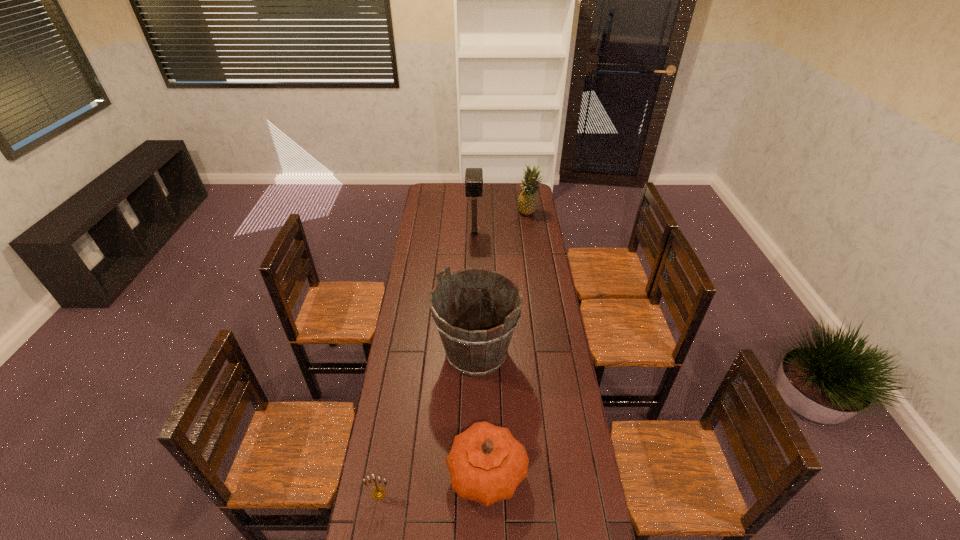
In order to click on free space located 0.200m on the front-facing side of the fourth tallest object in this screenshot , I will do `click(388, 473)`.

Locate an element on the screen. vacant space located 0.070m on the front-facing side of the fourth tallest object is located at coordinates (426, 473).

The height and width of the screenshot is (540, 960). In order to click on free location located 0.240m on the front-facing side of the fourth tallest object in this screenshot , I will do `click(376, 473)`.

Where is `vacant space located on the right of the candelabrum`? vacant space located on the right of the candelabrum is located at coordinates (440, 494).

Where is `object that is at the left edge`? object that is at the left edge is located at coordinates (378, 493).

Locate an element on the screen. The width and height of the screenshot is (960, 540). object that is at the right edge is located at coordinates (527, 201).

Find the location of `vacant position at the far edge of the desktop`. vacant position at the far edge of the desktop is located at coordinates click(x=448, y=199).

You are a GUI agent. You are given a task and a screenshot of the screen. Output one action in this format:
    pyautogui.click(x=<x>, y=<y>)
    Task: Click on the free space at the left edge of the desktop
    
    Given the screenshot: What is the action you would take?
    pyautogui.click(x=394, y=427)

In the image, there is a desktop. Identify the location of vacant space at the right edge. (567, 358).

Image resolution: width=960 pixels, height=540 pixels. Identify the location of free spot between the fourth tallest object and the leftmost object. (433, 483).